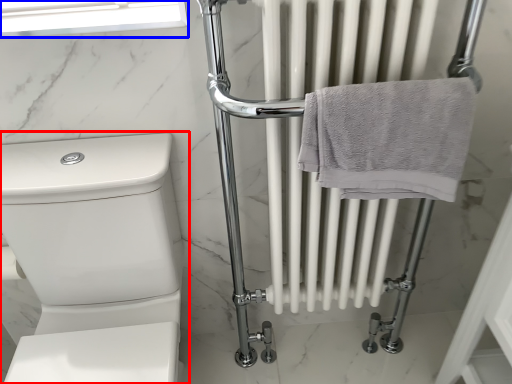
Question: Which object appears closest to the camera in this image, toilet (highlighted by a red box) or window screen (highlighted by a blue box)?

Choices:
 (A) toilet
 (B) window screen

Answer: (A)